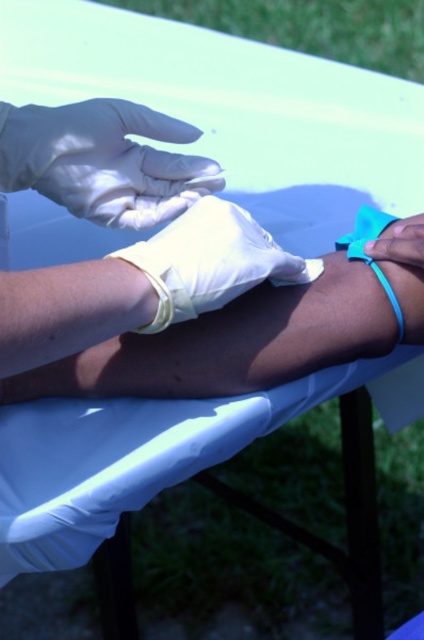
You are a medical student observing a blood draw procedure. You need to note the exact position of the white latex glove at upper center in the image. What are its coordinates?

The white latex glove at upper center is located at coordinates (103,161).

You are a medical student observing a blood draw procedure. You notice the white latex glove at upper center and the blue rubber band at lower right. Which object is closer to you in this scene?

The white latex glove at upper center is closer to you because it is in front of the blue rubber band at lower right.